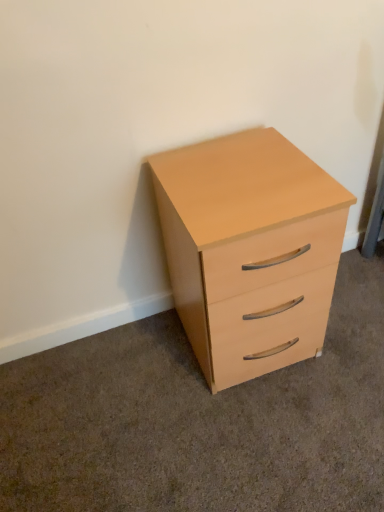
Find the location of `free space to the right of light wood/finish chest of drawers at center`. free space to the right of light wood/finish chest of drawers at center is located at coordinates (352, 328).